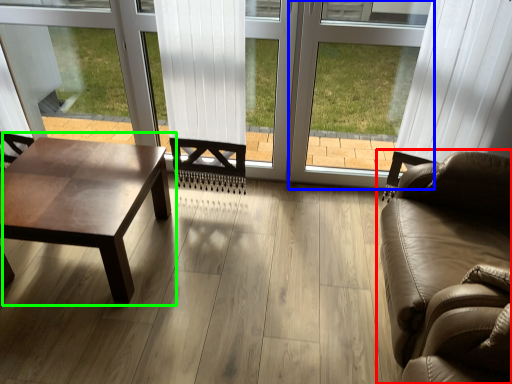
Question: Which object is the closest to the studio couch (highlighted by a red box)? Choose among these: window frame (highlighted by a blue box) or coffee table (highlighted by a green box).

Choices:
 (A) window frame
 (B) coffee table

Answer: (A)